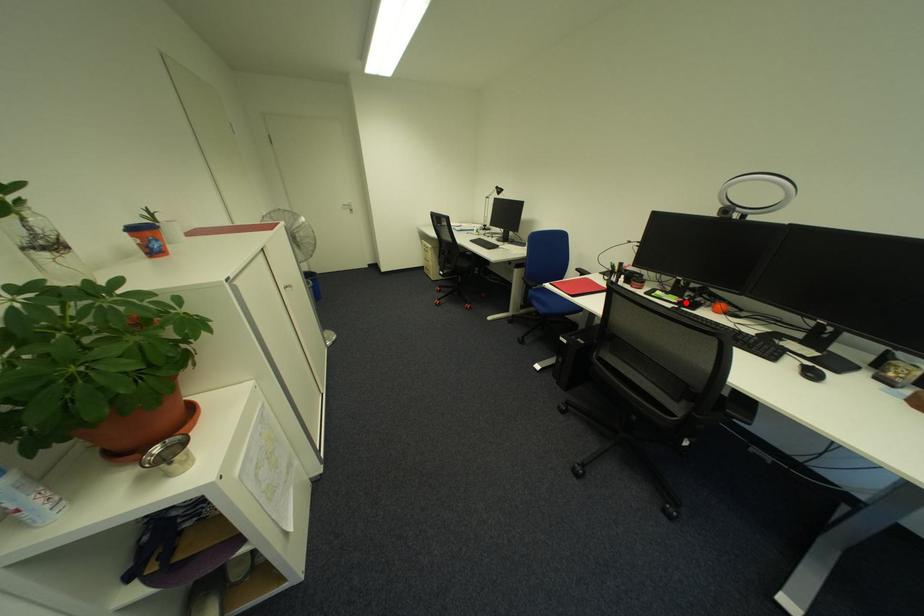
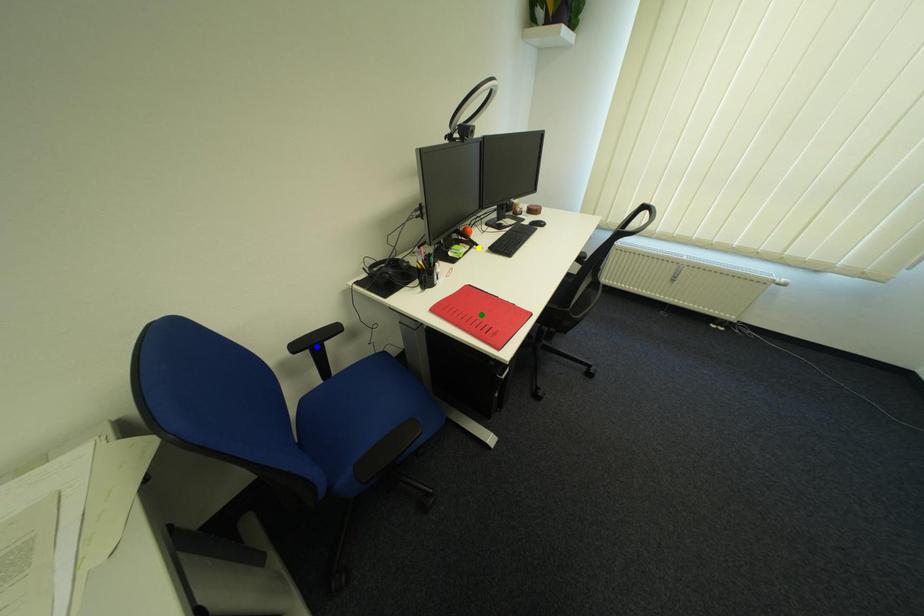
Question: I am providing you with two images of the same scene from different viewpoints. A red point is marked on the first image. You are given multiple points on the second image. Can you choose the point in image 2 that corresponds to the point in image 1?

Choices:
 (A) blue point
 (B) yellow point
 (C) green point

Answer: (B)